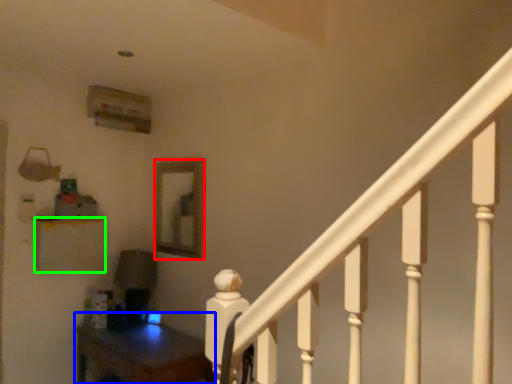
Question: Which object is positioned closest to mirror (highlighted by a red box)? Select from table (highlighted by a blue box) and furniture (highlighted by a green box).

Choices:
 (A) table
 (B) furniture

Answer: (B)